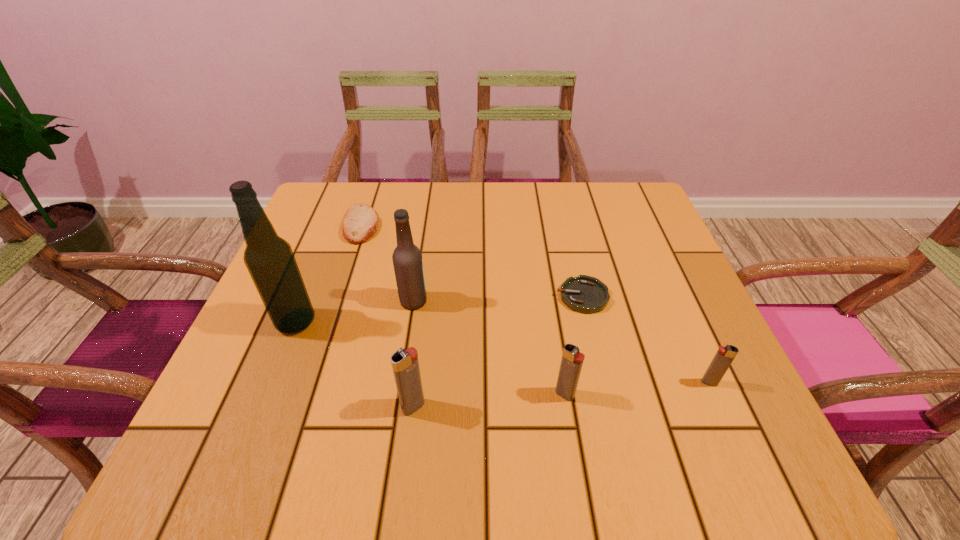
I want to click on free space that satisfies the following two spatial constraints: 1. on the side of the beer bottle with the label; 2. on the right side of the rightmost igniter, so click(x=401, y=382).